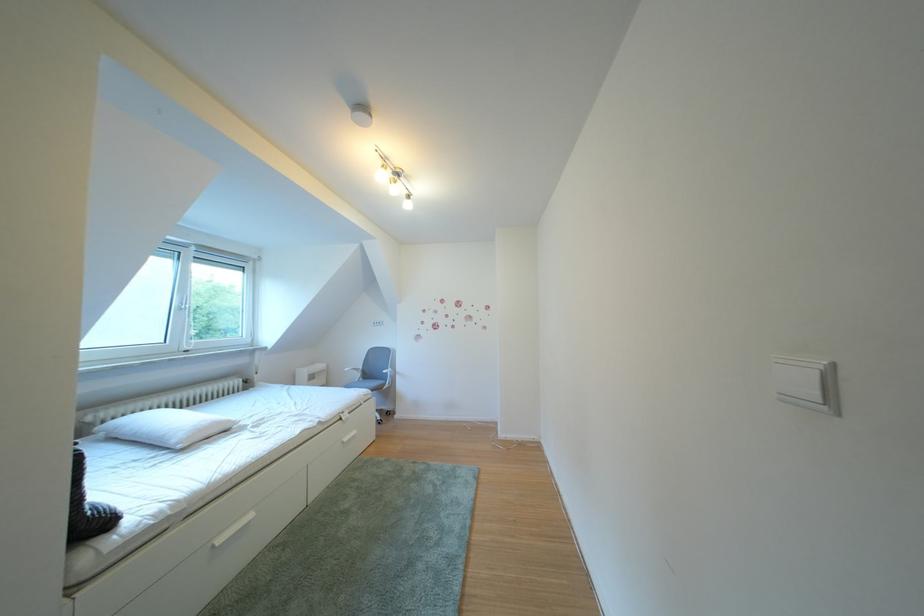
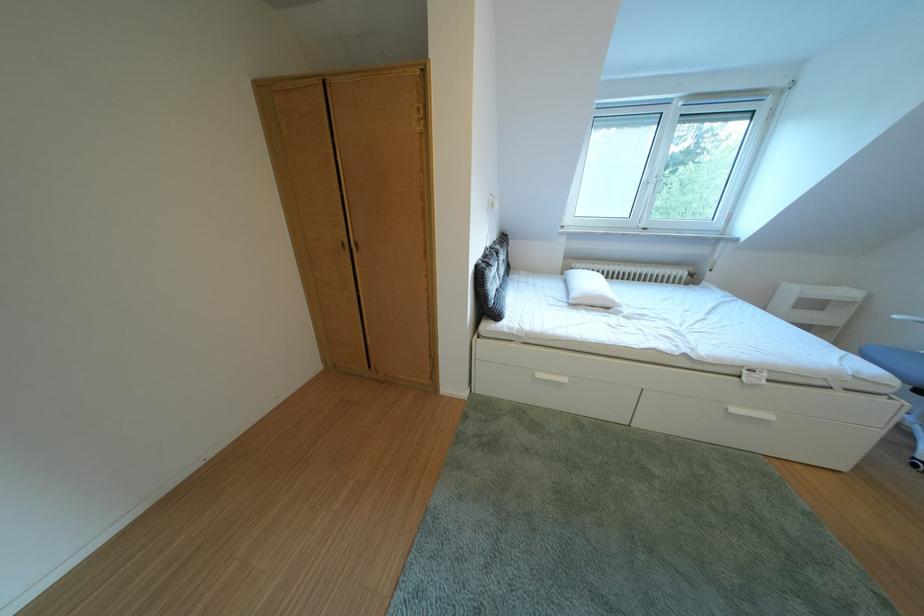
In the second image, find the point that corresponds to point (233, 546) in the first image.

(553, 381)